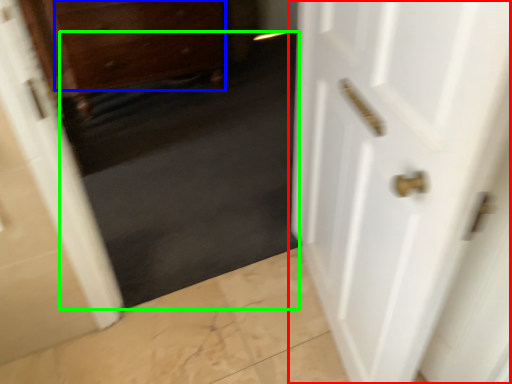
Question: Which is nearer to the door (highlighted by a red box)? drawer (highlighted by a blue box) or dark (highlighted by a green box).

Choices:
 (A) drawer
 (B) dark

Answer: (B)